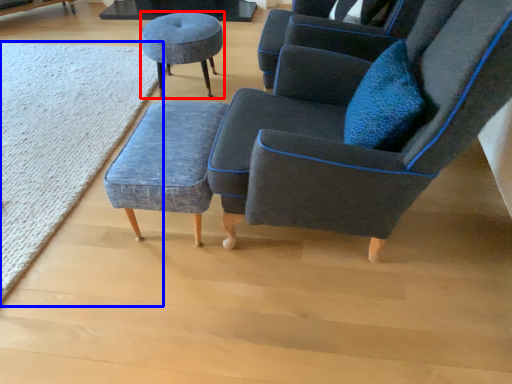
Question: Which of the following is the closest to the observer, stool (highlighted by a red box) or mat (highlighted by a blue box)?

Choices:
 (A) stool
 (B) mat

Answer: (B)